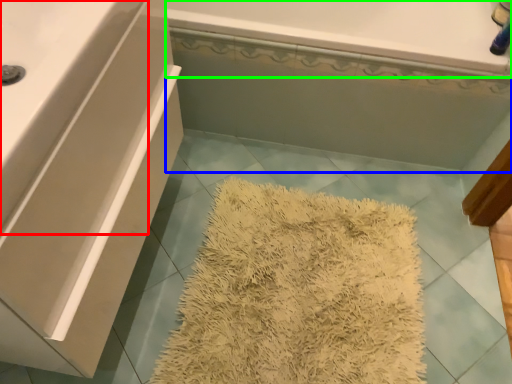
Question: Which object is positioned farthest from counter top (highlighted by a red box)? Select from bath (highlighted by a blue box) and bath (highlighted by a green box).

Choices:
 (A) bath
 (B) bath

Answer: (A)